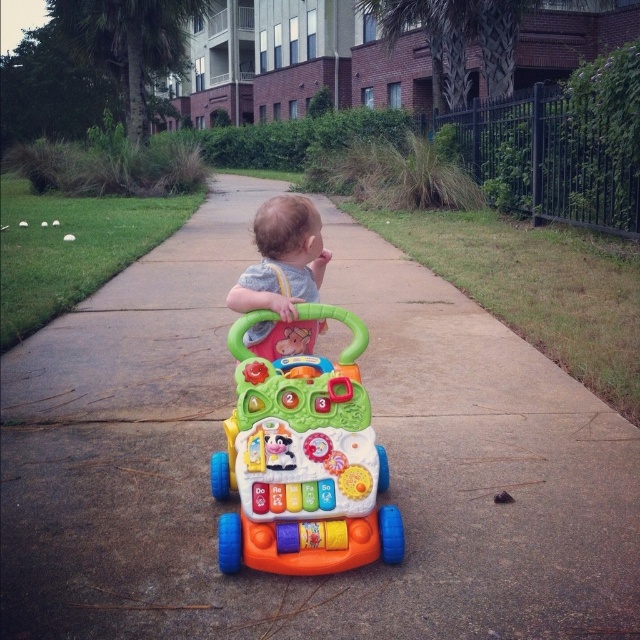
Question: Based on their relative distances, which object is nearer to the gray fabric baby at center?

Choices:
 (A) multicolored plastic walker at center
 (B) orange plastic walker at center

Answer: (A)

Question: Considering the relative positions of orange plastic walker at center and multicolored plastic walker at center in the image provided, where is orange plastic walker at center located with respect to multicolored plastic walker at center?

Choices:
 (A) below
 (B) above

Answer: (A)

Question: Is the position of orange plastic walker at center more distant than that of multicolored plastic walker at center?

Choices:
 (A) no
 (B) yes

Answer: (B)

Question: Which point appears closest to the camera in this image?

Choices:
 (A) (497, 630)
 (B) (252, 561)
 (C) (314, 211)

Answer: (A)

Question: Which object is the closest to the orange plastic walker at center?

Choices:
 (A) gray fabric baby at center
 (B) multicolored plastic walker at center

Answer: (B)

Question: Is multicolored plastic walker at center in front of gray fabric baby at center?

Choices:
 (A) yes
 (B) no

Answer: (A)